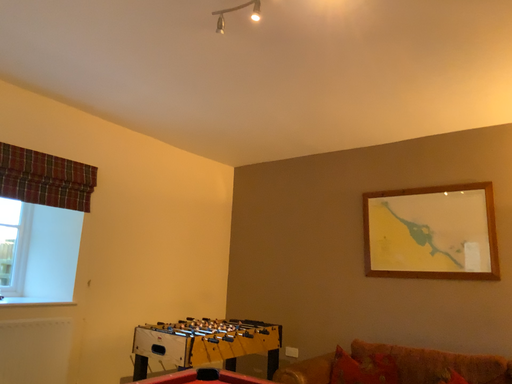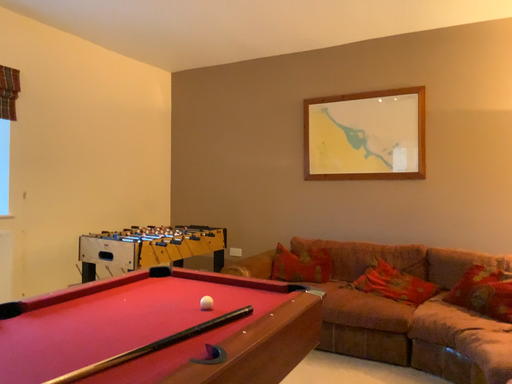
Question: Which way did the camera rotate in the video?

Choices:
 (A) rotated upward
 (B) rotated downward

Answer: (B)